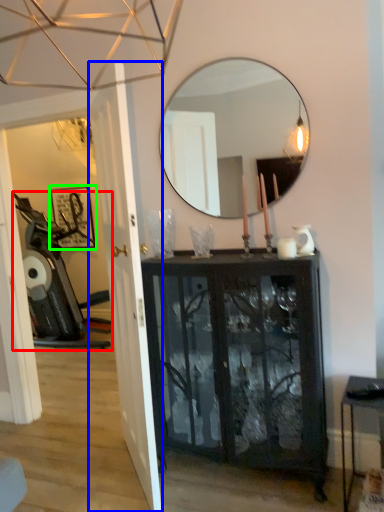
Question: Which object is the farthest from swivel chair (highlighted by a red box)? Choose among these: door (highlighted by a blue box) or picture frame (highlighted by a green box).

Choices:
 (A) door
 (B) picture frame

Answer: (A)